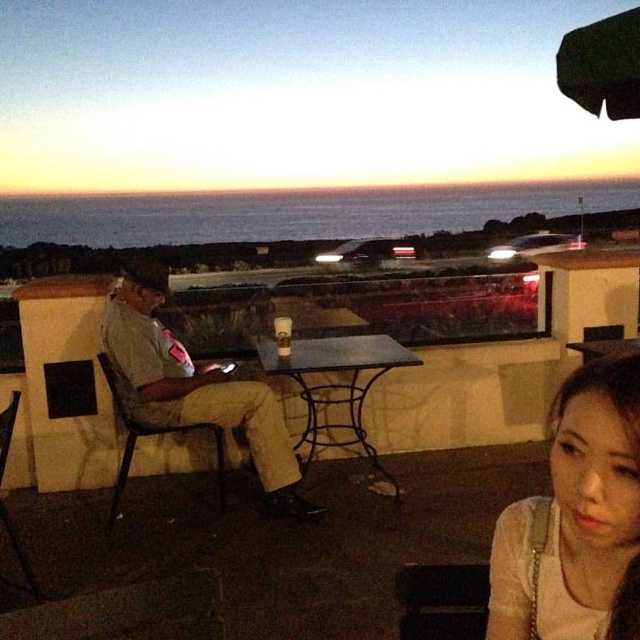
Question: Estimate the real-world distances between objects in this image. Which object is farther from the metallic black table at center?

Choices:
 (A) matte gray shirt at left
 (B) smooth white blouse at lower right

Answer: (B)

Question: Is matte gray shirt at left thinner than metallic black table at center?

Choices:
 (A) no
 (B) yes

Answer: (A)

Question: Does matte gray shirt at left appear over metallic black table at center?

Choices:
 (A) no
 (B) yes

Answer: (A)

Question: Which of the following is the closest to the observer?

Choices:
 (A) (294, 515)
 (B) (556, 508)

Answer: (B)

Question: Can you confirm if smooth white blouse at lower right is positioned to the right of metallic black table at center?

Choices:
 (A) yes
 (B) no

Answer: (A)

Question: Which point is farther to the camera?

Choices:
 (A) (355, 339)
 (B) (168, 328)

Answer: (B)